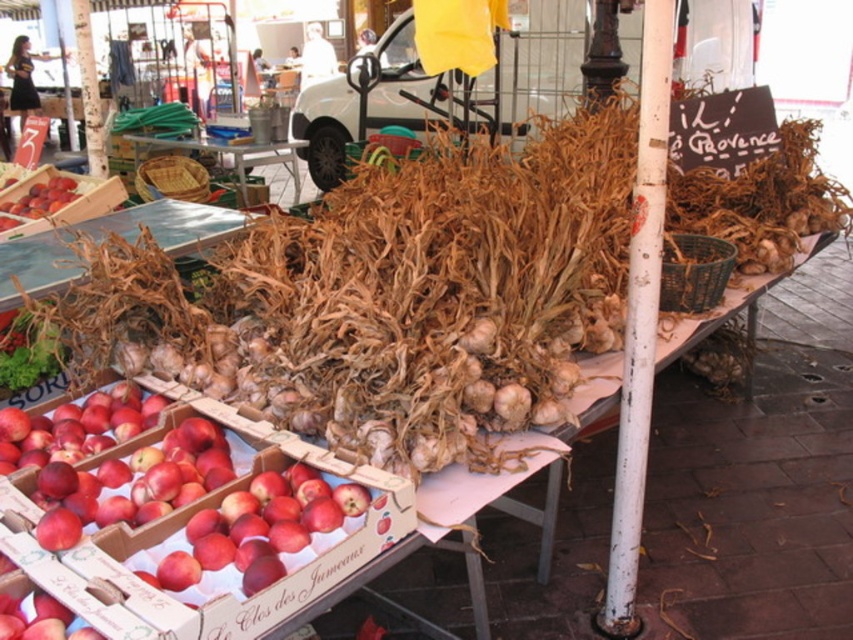
Is red matte peach box at center bigger than shiny red apples at lower left?

Yes.

Is red matte peach box at center below shiny red apples at lower left?

Indeed, red matte peach box at center is positioned under shiny red apples at lower left.

Based on the photo, measure the distance between red matte peach box at center and camera.

They are 1.06 meters apart.

The image size is (853, 640). What are the coordinates of `red matte peach box at center` in the screenshot? It's located at (184, 541).

Does shiny red apples at lower left have a greater height compared to green leafy vegetable at lower left?

Incorrect, shiny red apples at lower left's height is not larger of green leafy vegetable at lower left's.

This screenshot has width=853, height=640. Identify the location of shiny red apples at lower left. (132, 483).

The image size is (853, 640). What are the coordinates of `shiny red apples at lower left` in the screenshot? It's located at (x=132, y=483).

Can you confirm if woven wood basket at center is bigger than shiny red apples at left?

Yes, woven wood basket at center is bigger than shiny red apples at left.

What do you see at coordinates (231, 156) in the screenshot? I see `woven wood basket at center` at bounding box center [231, 156].

The image size is (853, 640). In order to click on woven wood basket at center in this screenshot , I will do `click(231, 156)`.